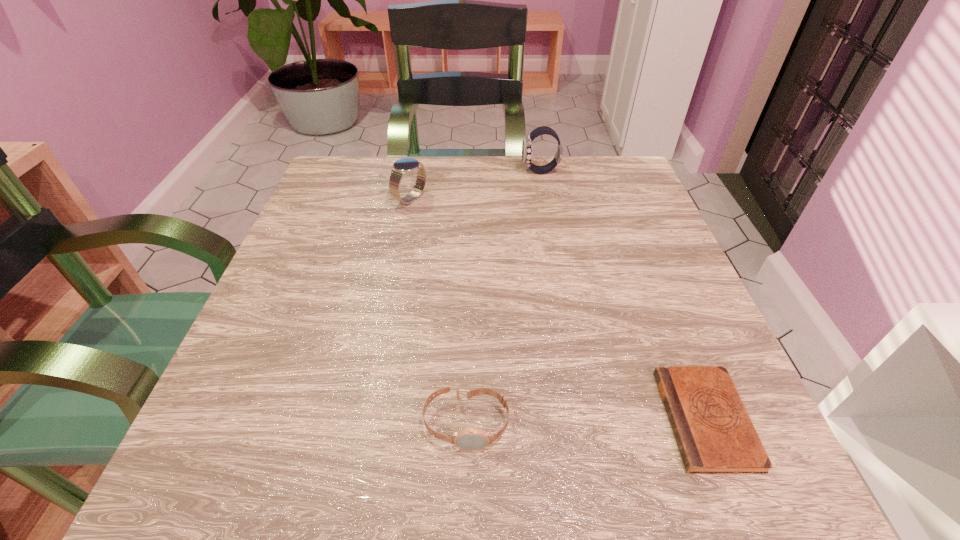
The width and height of the screenshot is (960, 540). Identify the location of vacant region located 0.050m on the face of the rightmost watch. [501, 172].

You are a GUI agent. You are given a task and a screenshot of the screen. Output one action in this format:
    pyautogui.click(x=<x>, y=<y>)
    Task: Click on the vacant space located 0.130m on the right of the third shortest object
    The height and width of the screenshot is (540, 960).
    Given the screenshot: What is the action you would take?
    pyautogui.click(x=485, y=199)

The width and height of the screenshot is (960, 540). Identify the location of blank area located on the face of the shortest watch. (465, 500).

Identify the location of free space located on the spine side of the rightmost object. This screenshot has width=960, height=540. (574, 419).

What are the coordinates of `vacant space located 0.130m on the spine side of the rightmost object` in the screenshot? It's located at (574, 419).

You are a GUI agent. You are given a task and a screenshot of the screen. Output one action in this format:
    pyautogui.click(x=<x>, y=<y>)
    Task: Click on the vacant space located on the spine side of the rightmost object
    The height and width of the screenshot is (540, 960).
    Given the screenshot: What is the action you would take?
    pos(523,419)

The height and width of the screenshot is (540, 960). What are the coordinates of `watch situated at the near edge` in the screenshot? It's located at (471, 438).

Find the location of `diary located in the near edge section of the desktop`. diary located in the near edge section of the desktop is located at coordinates (714, 433).

At what (x,y) coordinates should I click in order to perform the action: click on object located in the right edge section of the desktop. Please return your answer as a coordinate pair (x, y). Looking at the image, I should click on (714, 433).

Where is `object that is positioned at the near right corner`? The height and width of the screenshot is (540, 960). object that is positioned at the near right corner is located at coordinates (714, 433).